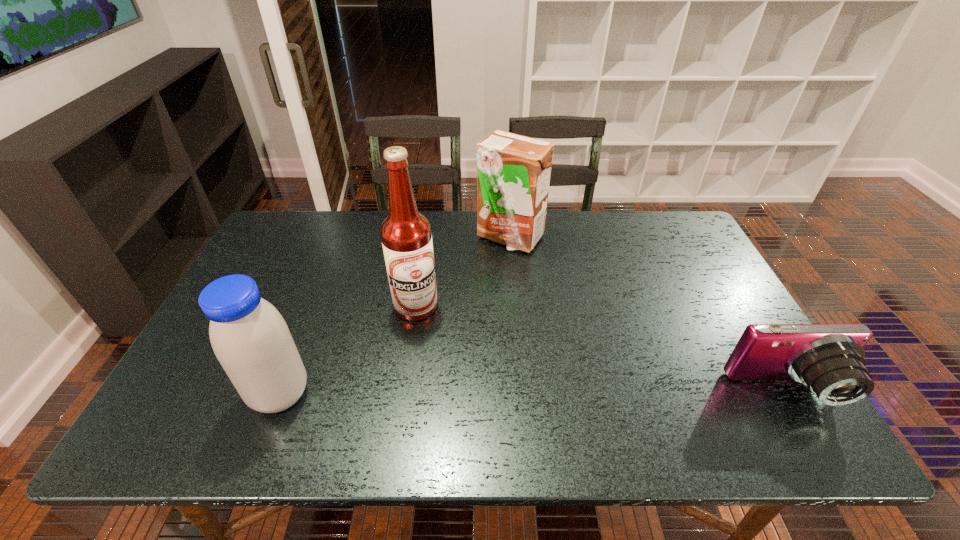
Locate an element on the screen. vacant space on the desktop that is between the leftmost object and the shortest object and is positioned on the label side of the tallest object is located at coordinates (509, 393).

The width and height of the screenshot is (960, 540). In order to click on vacant space on the desktop that is between the leftmost object and the shortest object and is positioned on the straw side of the carton in this screenshot , I will do `click(578, 393)`.